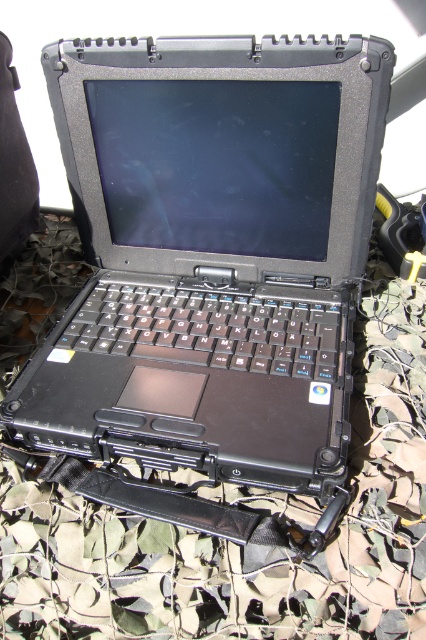
Is point (178, 138) less distant than point (58, 628)?

No, (178, 138) is further to viewer.

Does black matte laptop at center lie behind camouflage fabric at center?

That is True.

Is point (247, 461) in front of point (28, 248)?

That is True.

At what (x,y) coordinates should I click in order to perform the action: click on black matte laptop at center. Please return your answer as a coordinate pair (x, y). Looking at the image, I should click on (212, 253).